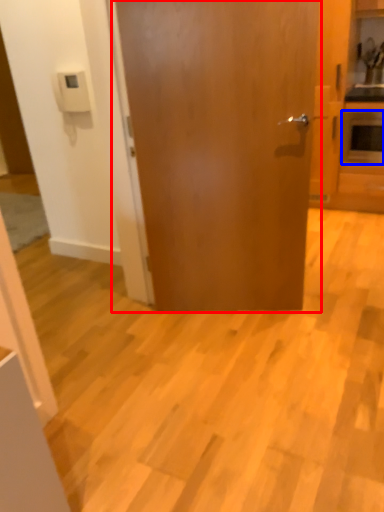
Question: Which object appears closest to the camera in this image, door (highlighted by a red box) or appliance (highlighted by a blue box)?

Choices:
 (A) door
 (B) appliance

Answer: (A)